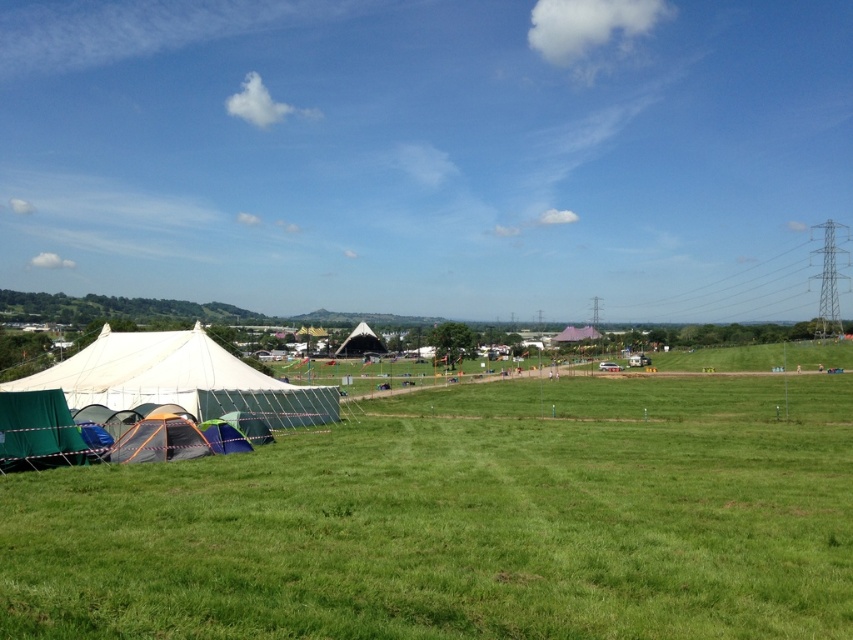
Looking at this image, you are planning to set up a picnic blanket between the green grassy field at lower left and the blue fabric tent at lower left. The picnic blanket is 2 meters long. Will there be enough space between them to place the blanket without it overlapping either the field or the tent?

The distance between the green grassy field at lower left and the blue fabric tent at lower left is 19.02 meters. Since the picnic blanket is only 2 meters long, there is ample space to place it without overlapping either the field or the tent.

You are standing at the point labeled as point (463, 522) in the image. Looking around, what do you see immediately around you?

You are standing on the green grassy field at lower left, as the point (463, 522) corresponds to that location.

You are planning to set up a picnic blanket between the white canvas tent at left and the blue fabric tent at lower left. Which tent has more space available next to it for the picnic blanket?

The white canvas tent at left has a larger width than the blue fabric tent at lower left, so there is more space available next to it for the picnic blanket.